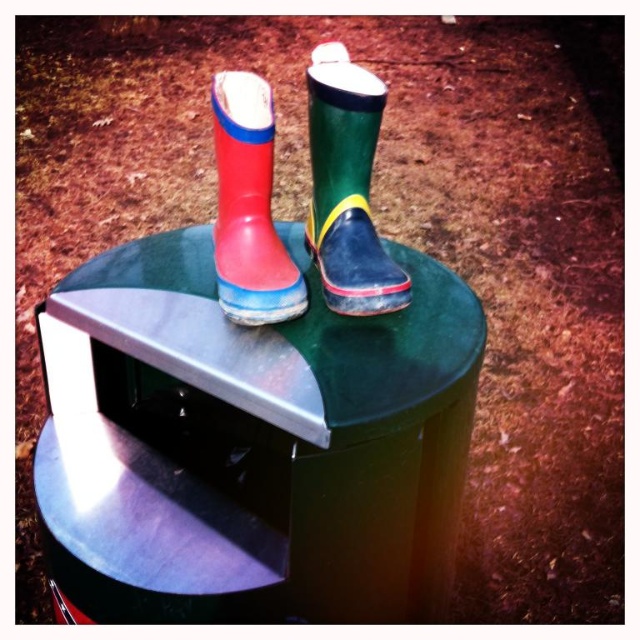
Can you confirm if green rubber boot at upper center is bigger than rubber/matte rain boot at upper center?

Correct, green rubber boot at upper center is larger in size than rubber/matte rain boot at upper center.

From the picture: Between green rubber boot at upper center and rubber/matte rain boot at upper center, which one is positioned lower?

rubber/matte rain boot at upper center is lower down.

Who is more distant from viewer, (324, 186) or (230, 163)?

The point (324, 186) is more distant.

Identify the location of green rubber boot at upper center. The height and width of the screenshot is (640, 640). (348, 188).

Is green rubber stool at center smaller than green rubber boot at upper center?

Incorrect, green rubber stool at center is not smaller in size than green rubber boot at upper center.

Image resolution: width=640 pixels, height=640 pixels. Describe the element at coordinates (250, 444) in the screenshot. I see `green rubber stool at center` at that location.

The image size is (640, 640). Identify the location of green rubber stool at center. (250, 444).

Is green rubber stool at center bigger than rubber/matte rain boot at upper center?

Correct, green rubber stool at center is larger in size than rubber/matte rain boot at upper center.

Looking at this image, can you confirm if green rubber stool at center is positioned below rubber/matte rain boot at upper center?

Correct, green rubber stool at center is located below rubber/matte rain boot at upper center.

Who is more distant from viewer, [406,396] or [284,275]?

Point [284,275]

Image resolution: width=640 pixels, height=640 pixels. In order to click on green rubber stool at center in this screenshot , I will do click(x=250, y=444).